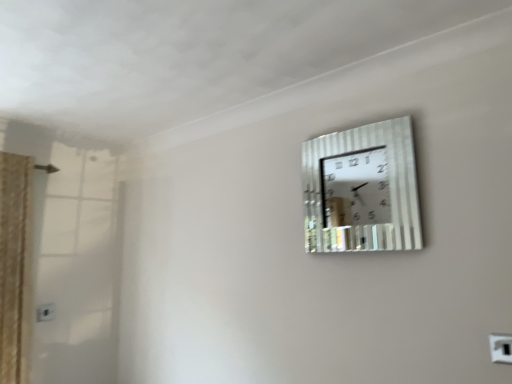
Question: From a real-world perspective, is metallic silver wall clock at upper right below white plastic electric outlet at lower left, positioned as the 1th electric outlet in bottom-to-top order?

Choices:
 (A) no
 (B) yes

Answer: (A)

Question: Could you tell me if metallic silver wall clock at upper right is facing white plastic electric outlet at lower left, positioned as the 1th electric outlet in bottom-to-top order?

Choices:
 (A) no
 (B) yes

Answer: (A)

Question: Is the position of metallic silver wall clock at upper right less distant than that of white plastic electric outlet at lower left, the first electric outlet when ordered from back to front?

Choices:
 (A) no
 (B) yes

Answer: (B)

Question: Can you confirm if metallic silver wall clock at upper right is bigger than white plastic electric outlet at lower left, the 2th electric outlet viewed from the front?

Choices:
 (A) yes
 (B) no

Answer: (A)

Question: Considering the relative positions of metallic silver wall clock at upper right and white plastic electric outlet at lower left, positioned as the 1th electric outlet in bottom-to-top order, in the image provided, is metallic silver wall clock at upper right to the left of white plastic electric outlet at lower left, positioned as the 1th electric outlet in bottom-to-top order, from the viewer's perspective?

Choices:
 (A) no
 (B) yes

Answer: (A)

Question: Can you confirm if metallic silver wall clock at upper right is positioned to the right of white plastic electric outlet at lower left, which appears as the second electric outlet when viewed from the right?

Choices:
 (A) no
 (B) yes

Answer: (B)

Question: From the image's perspective, is white plastic electric outlet at upper right, the first electric outlet positioned from the top, below metallic silver wall clock at upper right?

Choices:
 (A) no
 (B) yes

Answer: (B)

Question: Can you confirm if white plastic electric outlet at upper right, which appears as the 2th electric outlet when viewed from the left, is bigger than metallic silver wall clock at upper right?

Choices:
 (A) no
 (B) yes

Answer: (A)

Question: Is white plastic electric outlet at upper right, the first electric outlet positioned from the top, thinner than metallic silver wall clock at upper right?

Choices:
 (A) yes
 (B) no

Answer: (A)

Question: Can you confirm if white plastic electric outlet at upper right, marked as the 1th electric outlet in a right-to-left arrangement, is positioned to the right of metallic silver wall clock at upper right?

Choices:
 (A) no
 (B) yes

Answer: (B)

Question: Does white plastic electric outlet at upper right, which is the first electric outlet in front-to-back order, have a greater width compared to metallic silver wall clock at upper right?

Choices:
 (A) yes
 (B) no

Answer: (B)

Question: Considering the relative positions of white plastic electric outlet at upper right, marked as the 1th electric outlet in a right-to-left arrangement, and metallic silver wall clock at upper right in the image provided, is white plastic electric outlet at upper right, marked as the 1th electric outlet in a right-to-left arrangement, in front of metallic silver wall clock at upper right?

Choices:
 (A) yes
 (B) no

Answer: (A)

Question: Does white plastic electric outlet at lower left, the first electric outlet when ordered from back to front, have a smaller size compared to metallic silver wall clock at upper right?

Choices:
 (A) yes
 (B) no

Answer: (A)